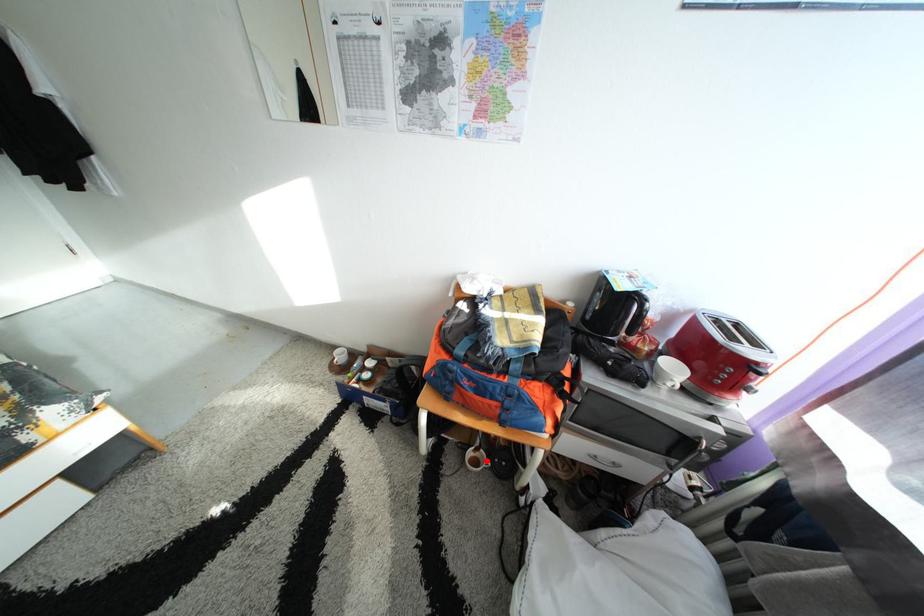
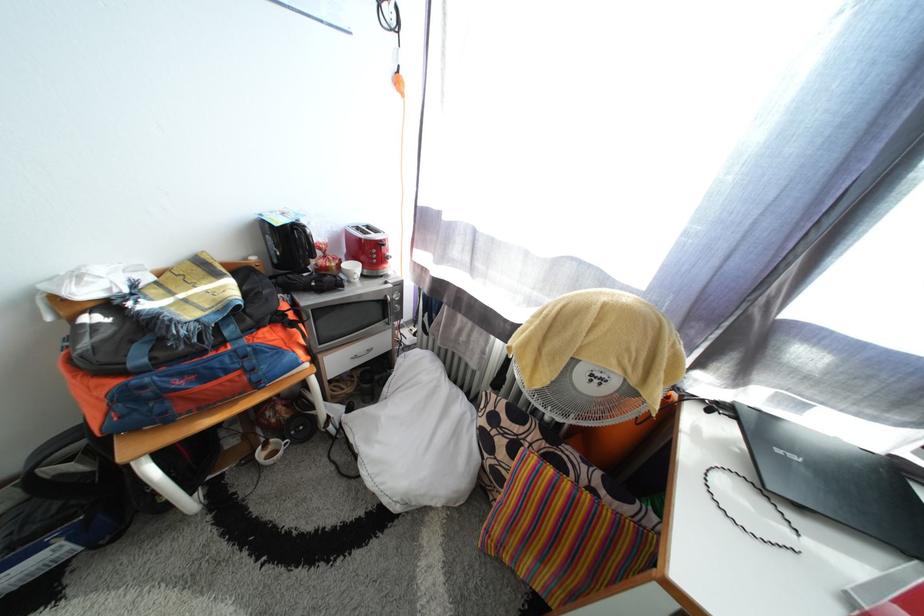
Question: A red point is marked in image1. In image2, is the corresponding 3D point closer to the camera or farther? Reply with the corresponding letter.

Choices:
 (A) The corresponding 3D point is closer.
 (B) The corresponding 3D point is farther.

Answer: (A)